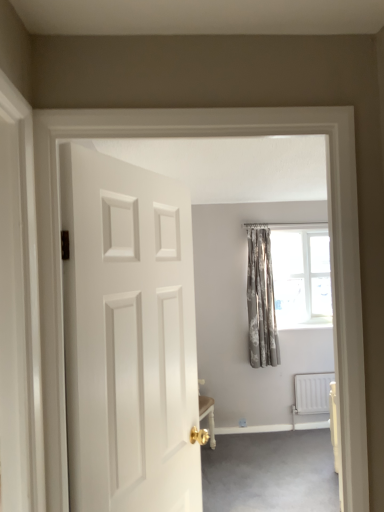
Question: Is white matte door at center spatially inside carpet at lower right, or outside of it?

Choices:
 (A) inside
 (B) outside

Answer: (B)

Question: Considering the positions of white matte door at center and carpet at lower right in the image, is white matte door at center taller or shorter than carpet at lower right?

Choices:
 (A) tall
 (B) short

Answer: (A)

Question: Based on their relative distances, which object is farther from the silver textured curtains at center?

Choices:
 (A) white metallic radiator at lower right
 (B) patterned fabric curtain at upper right
 (C) white matte door at center
 (D) carpet at lower right

Answer: (C)

Question: Which of these objects is positioned farthest from the white matte door at center?

Choices:
 (A) carpet at lower right
 (B) patterned fabric curtain at upper right
 (C) silver textured curtains at center
 (D) white metallic radiator at lower right

Answer: (D)